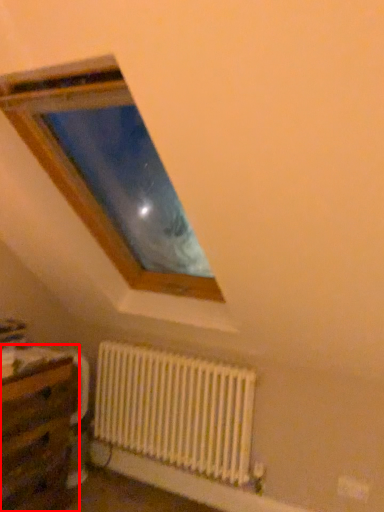
Question: From the image's perspective, considering the relative positions of table (annotated by the red box) and radiator in the image provided, where is table (annotated by the red box) located with respect to the staircase?

Choices:
 (A) above
 (B) below

Answer: (B)